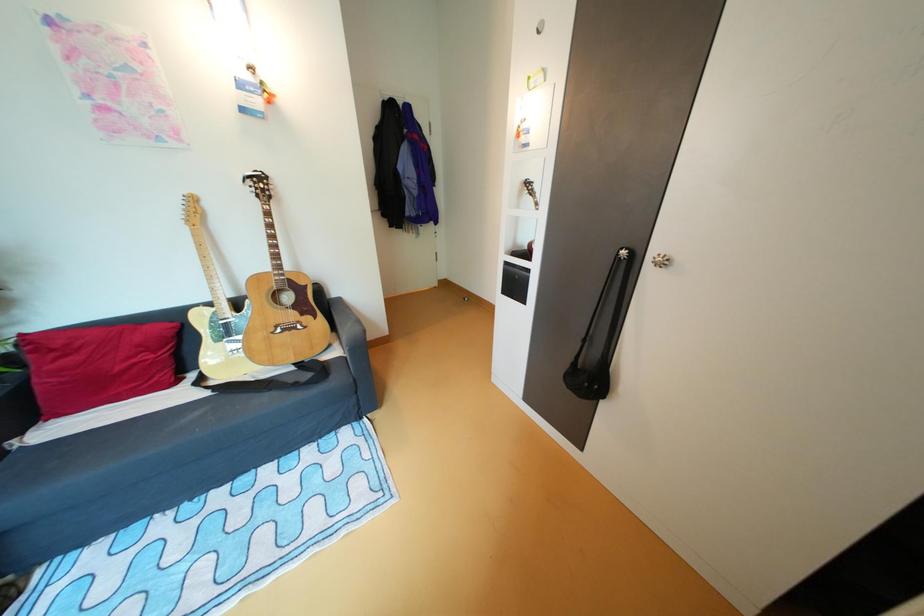
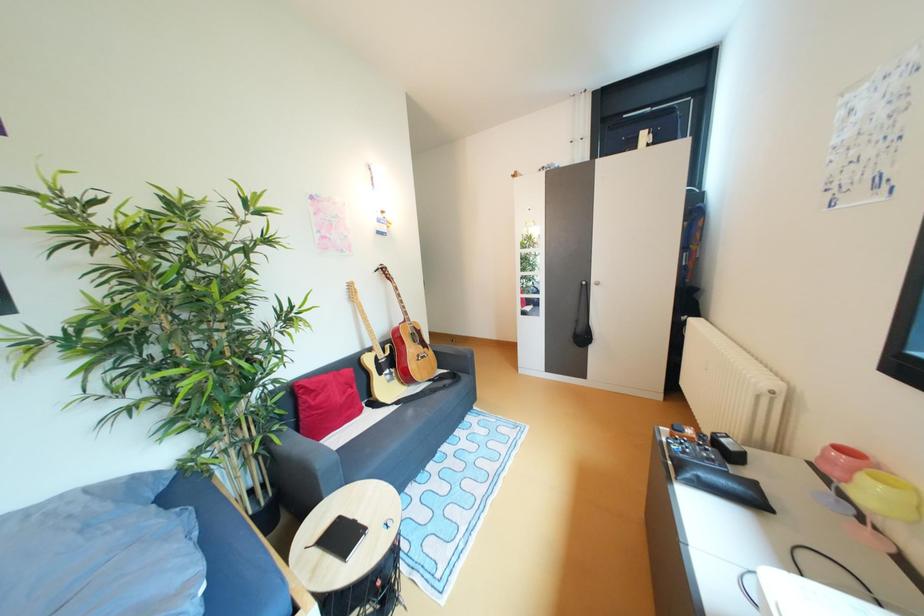
The images are taken continuously from a first-person perspective. In which direction are you moving?

The cameraman moved toward left, backward.